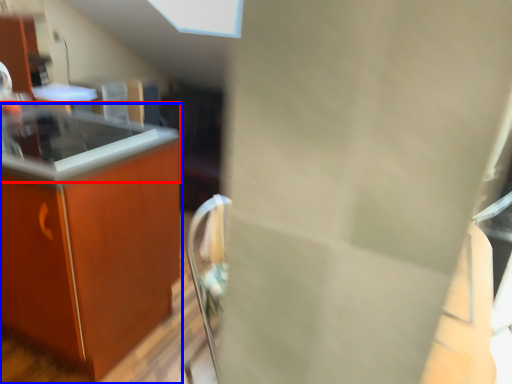
Question: Among these objects, which one is nearest to the camera, countertop (highlighted by a red box) or countertop (highlighted by a blue box)?

Choices:
 (A) countertop
 (B) countertop

Answer: (B)